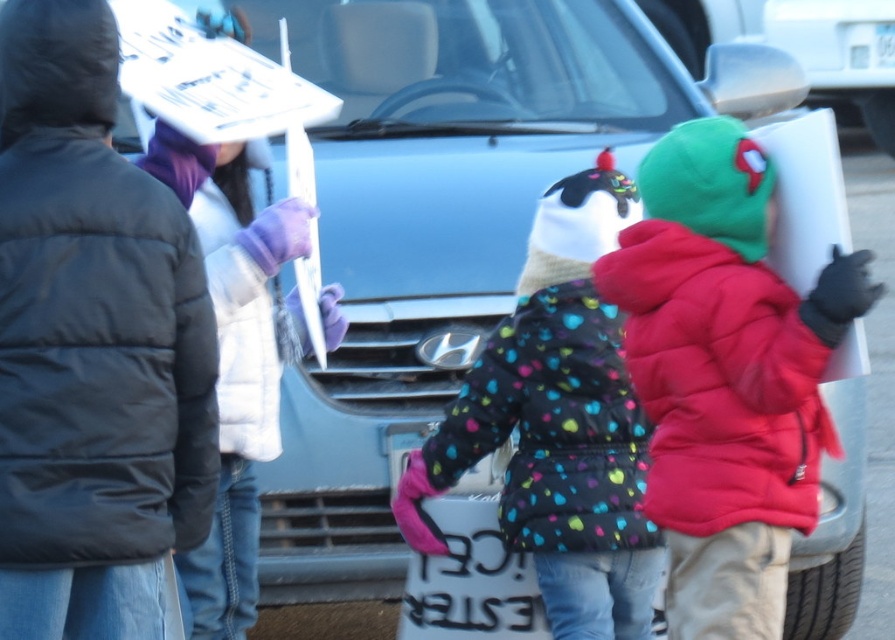
Where is `red puffy coat at right`? red puffy coat at right is located at coordinates (726, 372).

Which is behind, point (797, 464) or point (800, 20)?

The point (800, 20) is more distant.

This screenshot has height=640, width=895. What are the coordinates of `red puffy coat at right` in the screenshot? It's located at pyautogui.click(x=726, y=372).

Does matte black jacket at left have a lesser width compared to metallic silver mirror at upper right?

Correct, matte black jacket at left's width is less than metallic silver mirror at upper right's.

Is matte black jacket at left bigger than metallic silver mirror at upper right?

No, matte black jacket at left is not bigger than metallic silver mirror at upper right.

Who is more forward, (97,525) or (840,19)?

Point (97,525) is more forward.

The height and width of the screenshot is (640, 895). In order to click on matte black jacket at left in this screenshot , I will do `click(94, 342)`.

Is point (62, 301) in front of point (553, 426)?

Yes.

In the scene shown: Is matte black jacket at left above polka dot puffer jacket at center?

Yes, matte black jacket at left is above polka dot puffer jacket at center.

Between point (105, 444) and point (629, 600), which one is positioned in front?

Point (105, 444) is more forward.

Image resolution: width=895 pixels, height=640 pixels. I want to click on matte black jacket at left, so click(x=94, y=342).